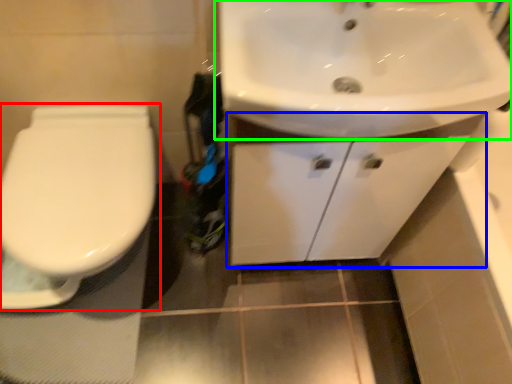
Question: Which is farther away from toilet (highlighted by a red box)? bathroom cabinet (highlighted by a blue box) or sink (highlighted by a green box)?

Choices:
 (A) bathroom cabinet
 (B) sink

Answer: (B)